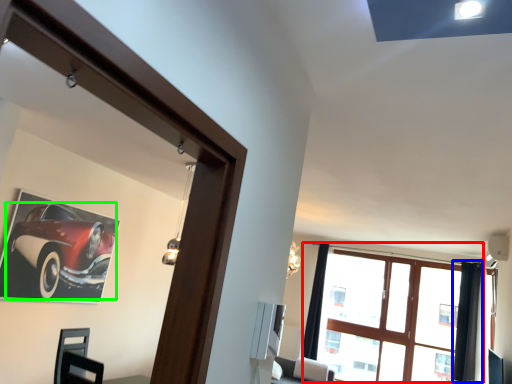
Question: Which object is the closest to the window (highlighted by a red box)? Choose among these: curtain (highlighted by a blue box) or car (highlighted by a green box).

Choices:
 (A) curtain
 (B) car

Answer: (A)